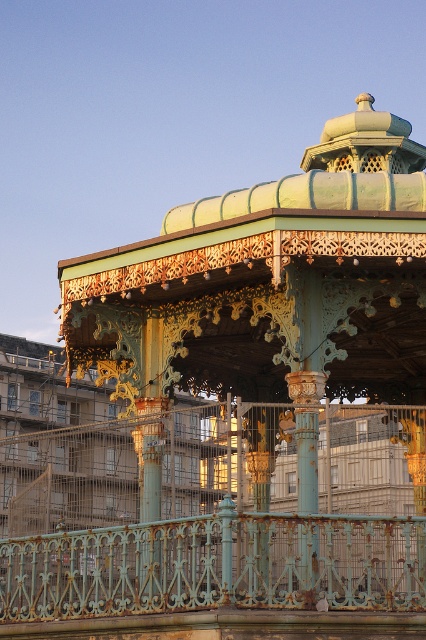
Which is below, rusty metal gazebo at center or rusty metal railing at lower center?

rusty metal railing at lower center is below.

Can you confirm if rusty metal gazebo at center is smaller than rusty metal railing at lower center?

No, rusty metal gazebo at center is not smaller than rusty metal railing at lower center.

This screenshot has width=426, height=640. Describe the element at coordinates (270, 289) in the screenshot. I see `rusty metal gazebo at center` at that location.

The height and width of the screenshot is (640, 426). What are the coordinates of `rusty metal gazebo at center` in the screenshot? It's located at (270, 289).